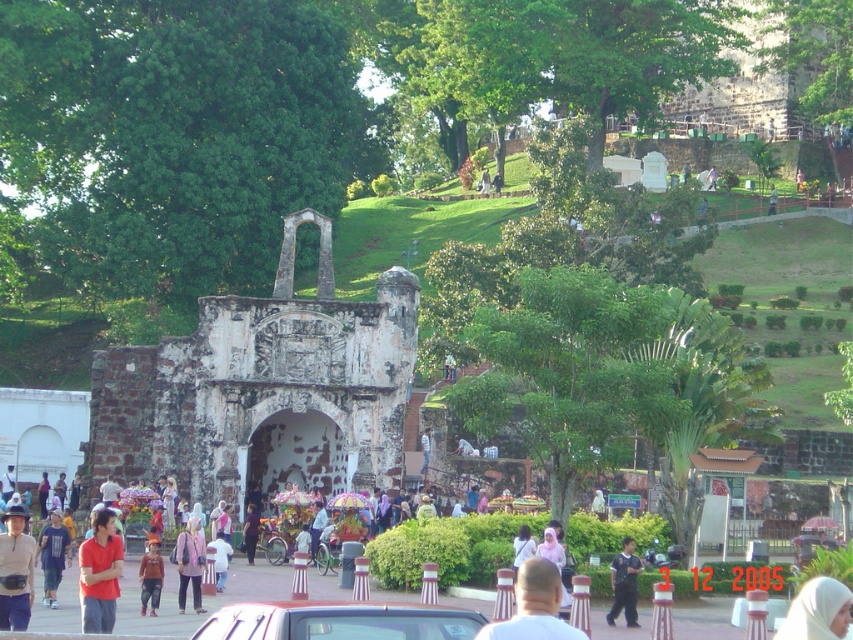
You are a photographer standing in front of the old stone archway. You notice a person wearing a white fabric headscarf at center and another wearing a dark blue shirt at center. Which clothing item is positioned higher relative to the other in the scene?

The white fabric headscarf at center is much taller than the dark blue shirt at center, so the headscarf is positioned higher.